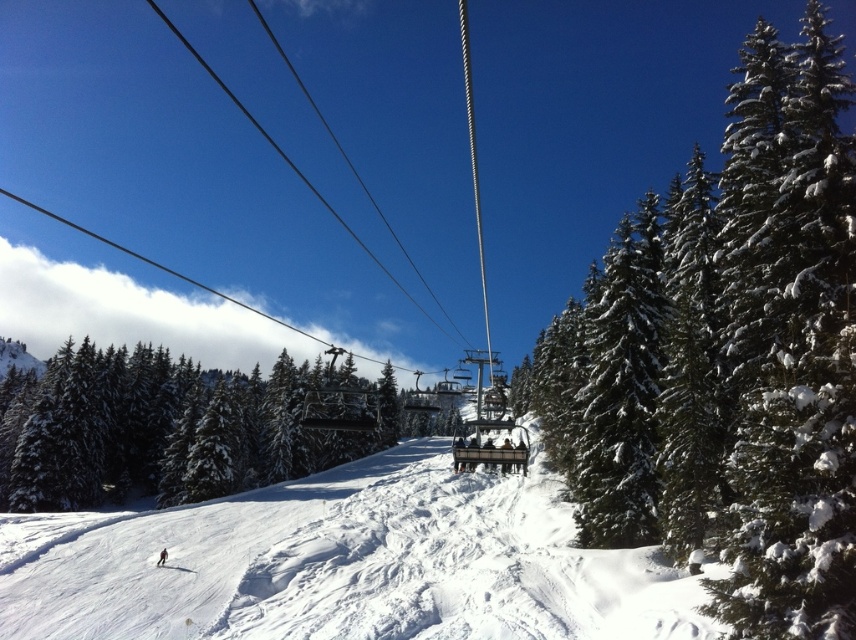
Is point (828, 456) farther from viewer compared to point (170, 566)?

No, it is not.

Does green textured pine tree at right come behind white snowboard at lower center?

No, it is in front of white snowboard at lower center.

Between point (788, 342) and point (182, 566), which one is positioned behind?

Point (182, 566)

In order to click on green textured pine tree at right in this screenshot , I will do `click(776, 348)`.

Which is more to the left, green snow-covered pine at center or red snowboard at center?

From the viewer's perspective, green snow-covered pine at center appears more on the left side.

Locate an element on the screen. The height and width of the screenshot is (640, 856). green snow-covered pine at center is located at coordinates (173, 426).

Does white snow ski slope at center have a lesser height compared to green snow-covered pine at center?

Correct, white snow ski slope at center is not as tall as green snow-covered pine at center.

Which is in front, point (530, 598) or point (134, 476)?

Point (530, 598)

You are a GUI agent. You are given a task and a screenshot of the screen. Output one action in this format:
    pyautogui.click(x=<x>, y=<y>)
    Task: Click on the white snow ski slope at center
    
    Given the screenshot: What is the action you would take?
    pyautogui.click(x=343, y=564)